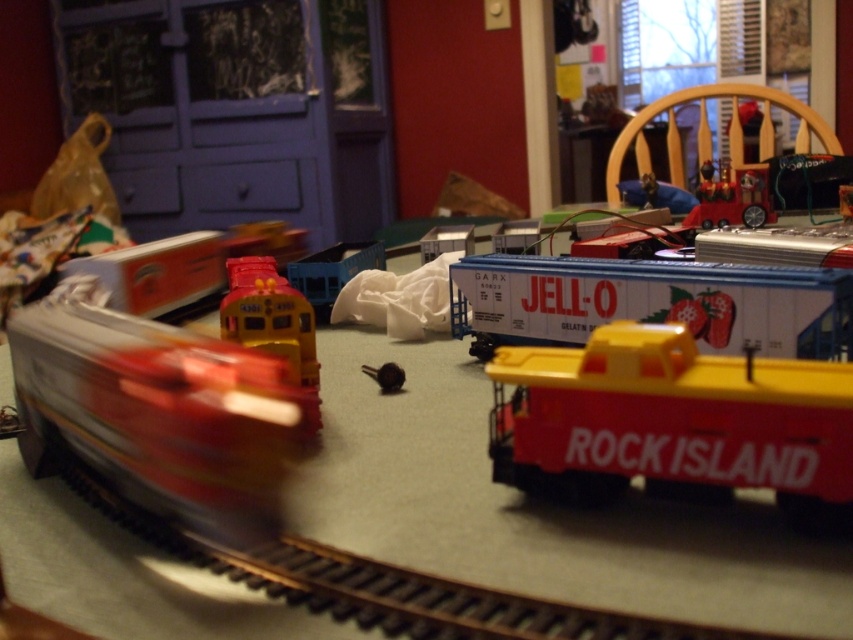
In the scene shown: You are a toy collector standing 1.5 meters away from the table where the model train setup is displayed. You want to pick up the metallic red train at upper right. Can you reach it without moving closer to the table?

The metallic red train at upper right is 1.27 meters away from the camera. Since you are standing 1.5 meters away from the table, you can reach it without moving closer because the distance to the train is less than your current distance from the table.

You are a toy collector examining a miniature train setup. You see a white plastic train car at center and a yellow plastic train at center. Which one appears closer to you?

The white plastic train car at center is further to the viewer than yellow plastic train at center.

Consider the image. You are a toy collector inspecting the model train setup. You notice the white plastic train car at center and the yellow plastic train at center. Which one is located above the other?

The white plastic train car at center is positioned under the yellow plastic train at center, so the yellow plastic train at center is above the white plastic train car at center.